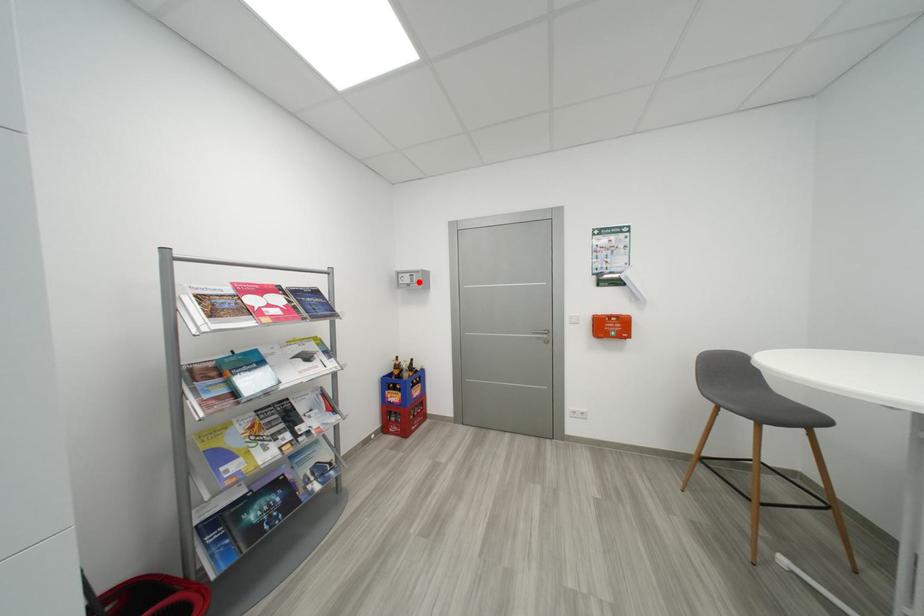
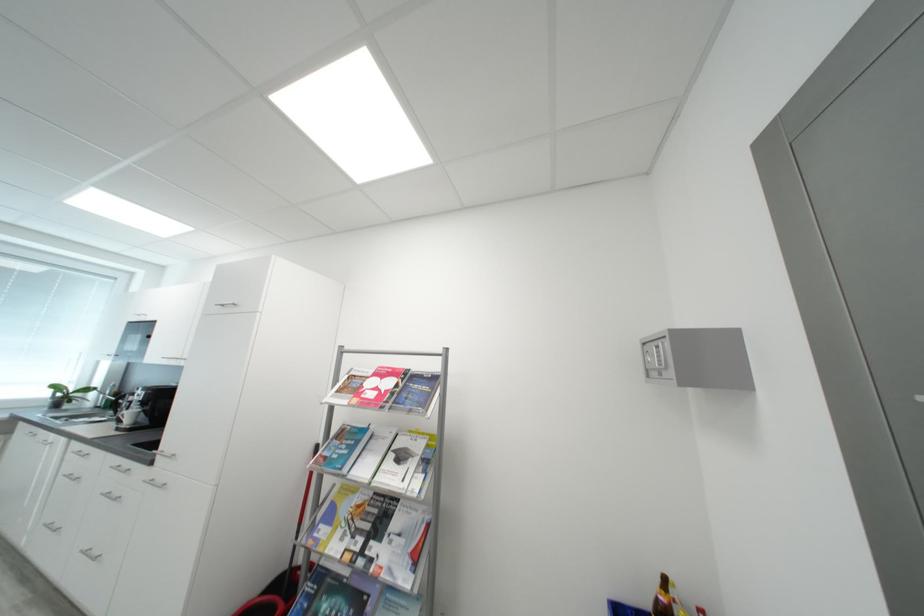
Question: I am providing you with two images of the same scene from different viewpoints. A red point is marked on the first image. Can you still see the location of the red point in image 2?

Choices:
 (A) Yes
 (B) No

Answer: (A)